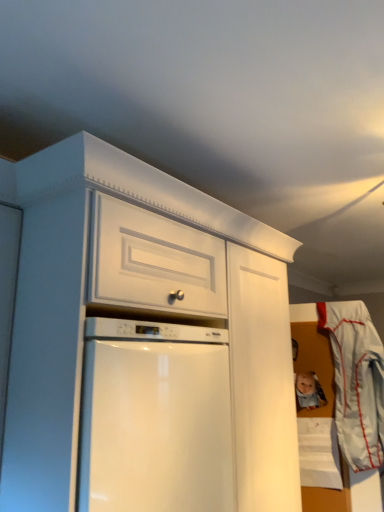
Question: Based on their positions, is white fabric laundry at right located to the left or right of matte plastic toy at lower right?

Choices:
 (A) left
 (B) right

Answer: (B)

Question: Considering the positions of white fabric laundry at right and matte plastic toy at lower right in the image, is white fabric laundry at right taller or shorter than matte plastic toy at lower right?

Choices:
 (A) tall
 (B) short

Answer: (A)

Question: Is white fabric laundry at right in front of or behind matte plastic toy at lower right in the image?

Choices:
 (A) behind
 (B) front

Answer: (B)

Question: From a real-world perspective, relative to white fabric laundry at right, is matte plastic toy at lower right vertically above or below?

Choices:
 (A) below
 (B) above

Answer: (B)

Question: From the image's perspective, relative to white fabric laundry at right, is matte plastic toy at lower right above or below?

Choices:
 (A) above
 (B) below

Answer: (A)

Question: Looking at the image, does matte plastic toy at lower right seem bigger or smaller compared to white fabric laundry at right?

Choices:
 (A) big
 (B) small

Answer: (B)

Question: From their relative heights in the image, would you say matte plastic toy at lower right is taller or shorter than white fabric laundry at right?

Choices:
 (A) short
 (B) tall

Answer: (A)